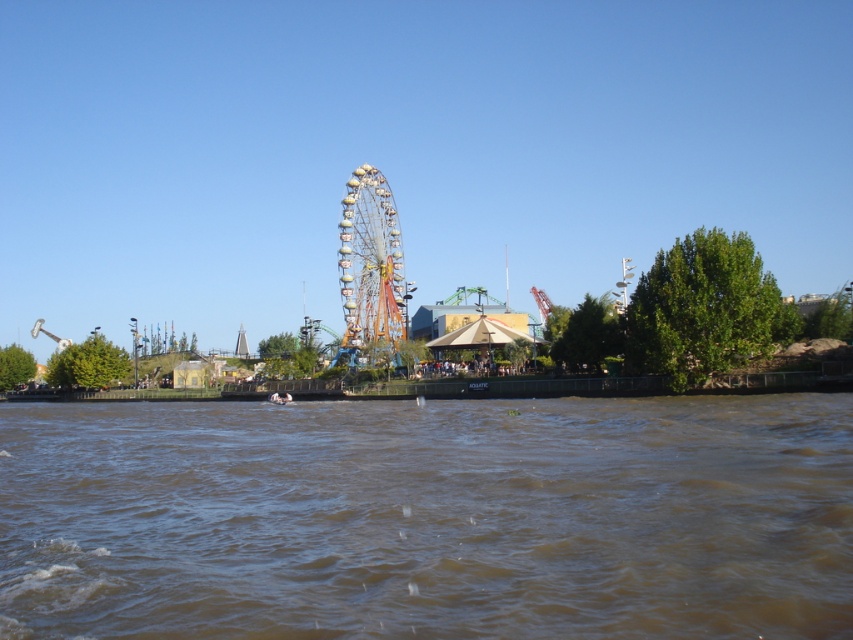
Question: Which point is closer to the camera?

Choices:
 (A) brown muddy water at lower center
 (B) multicolored metallic ferris wheel at center
 (C) metallic ferris wheel at center

Answer: (A)

Question: Is brown muddy water at lower center positioned in front of multicolored metallic ferris wheel at center?

Choices:
 (A) yes
 (B) no

Answer: (A)

Question: Which point is closer to the camera taking this photo?

Choices:
 (A) (810, 396)
 (B) (299, 332)
 (C) (352, 236)

Answer: (A)

Question: Is brown muddy water at lower center above metallic ferris wheel at center?

Choices:
 (A) no
 (B) yes

Answer: (A)

Question: Among these points, which one is farthest from the camera?

Choices:
 (A) (396, 278)
 (B) (21, 388)

Answer: (B)

Question: Does metallic ferris wheel at center lie in front of multicolored metallic ferris wheel at center?

Choices:
 (A) no
 (B) yes

Answer: (B)